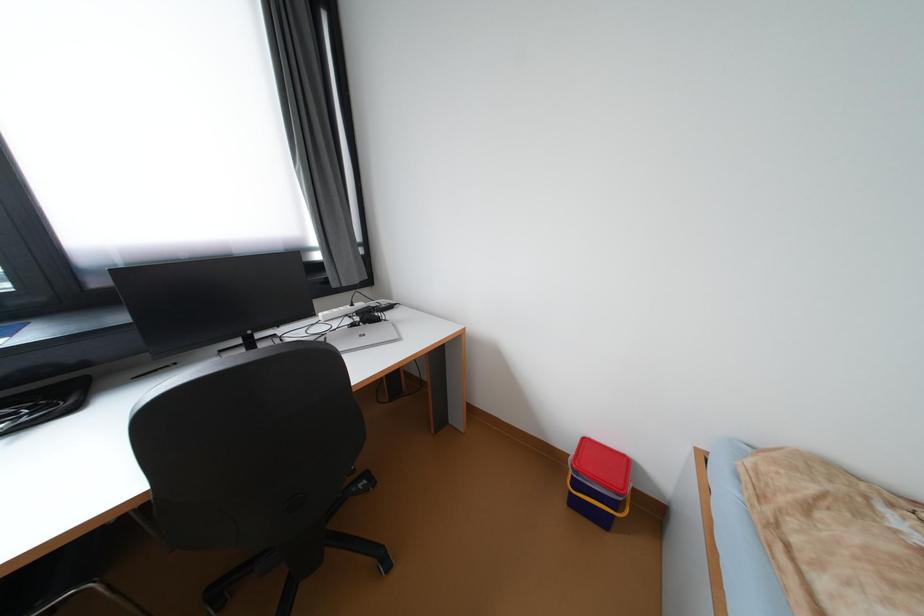
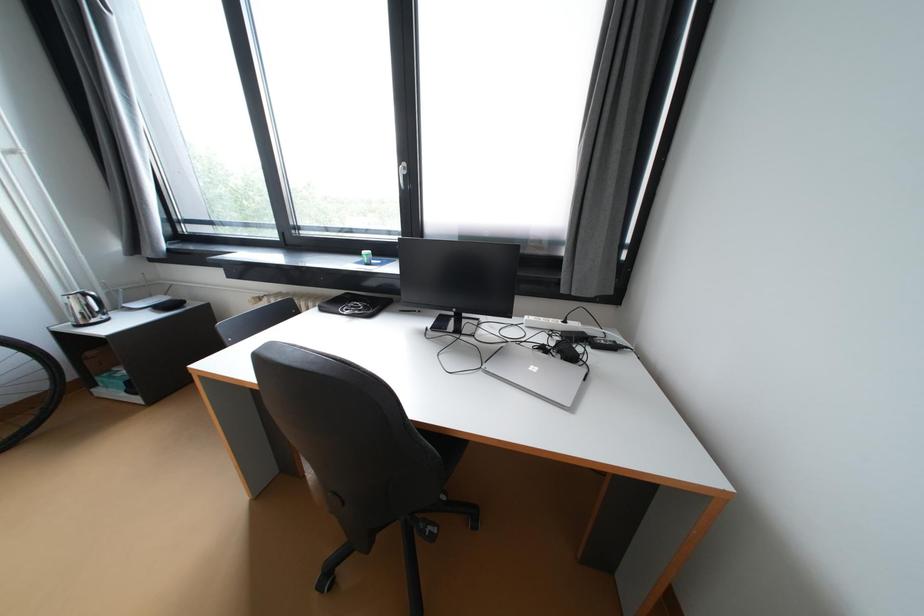
Question: The camera is either moving clockwise (left) or counter-clockwise (right) around the object. The first image is from the beginning of the video and the second image is from the end. Is the camera moving left or right when shooting the video?

Choices:
 (A) Left
 (B) Right

Answer: (B)